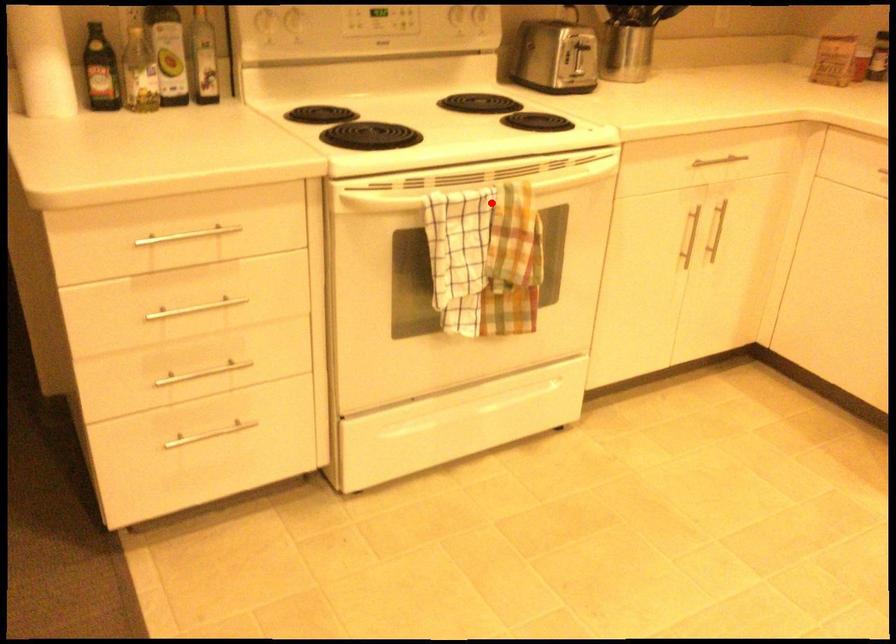
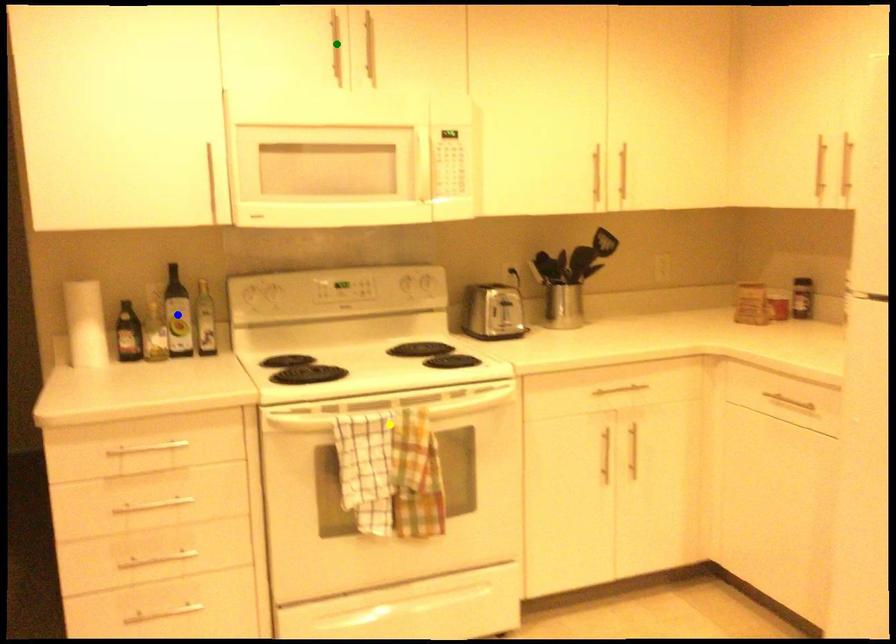
Question: I am providing you with two images of the same scene from different viewpoints. A red point is marked on the first image. You are given multiple points on the second image. Which point in image 2 represents the same 3d spot as the red point in image 1?

Choices:
 (A) blue point
 (B) yellow point
 (C) green point

Answer: (B)